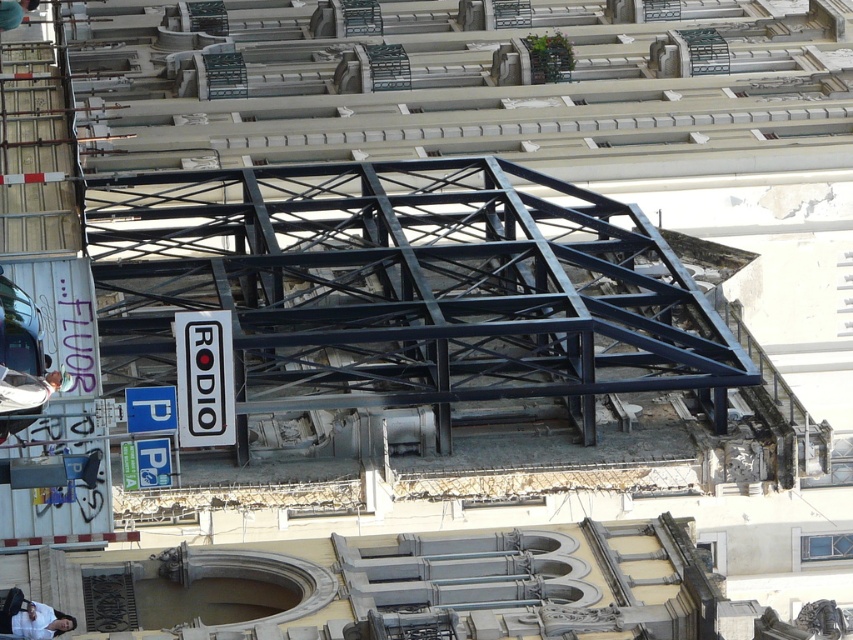
Between point (219, 416) and point (35, 604), which one is positioned in front?

Point (35, 604) is in front.

Does point (204, 396) come closer to viewer compared to point (68, 616)?

No, (204, 396) is further to viewer.

This screenshot has width=853, height=640. What are the coordinates of `white plastic signboard at center` in the screenshot? It's located at (204, 378).

Between point (634, 257) and point (3, 429), which one is positioned behind?

The point (634, 257) is more distant.

Does black metal framework at center come behind white fabric shirt at lower left?

Yes, black metal framework at center is behind white fabric shirt at lower left.

Does point (549, 298) come closer to viewer compared to point (27, 426)?

No, (549, 298) is further to viewer.

This screenshot has width=853, height=640. In order to click on black metal framework at center in this screenshot , I will do `click(405, 288)`.

Does white fabric shirt at lower left appear over light blue shirt at lower left?

Yes, white fabric shirt at lower left is above light blue shirt at lower left.

Can you confirm if white fabric shirt at lower left is bigger than light blue shirt at lower left?

Actually, white fabric shirt at lower left might be smaller than light blue shirt at lower left.

The image size is (853, 640). Describe the element at coordinates (25, 390) in the screenshot. I see `white fabric shirt at lower left` at that location.

You are a GUI agent. You are given a task and a screenshot of the screen. Output one action in this format:
    pyautogui.click(x=<x>, y=<y>)
    Task: Click on the white fabric shirt at lower left
    The width and height of the screenshot is (853, 640).
    Given the screenshot: What is the action you would take?
    pyautogui.click(x=25, y=390)